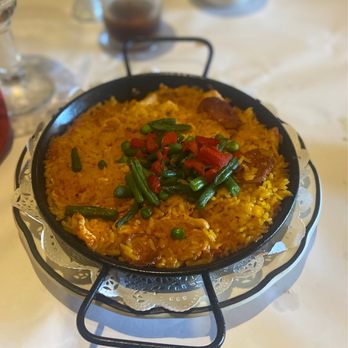
Where is `doily`? The image size is (348, 348). doily is located at coordinates (273, 244), (58, 253).